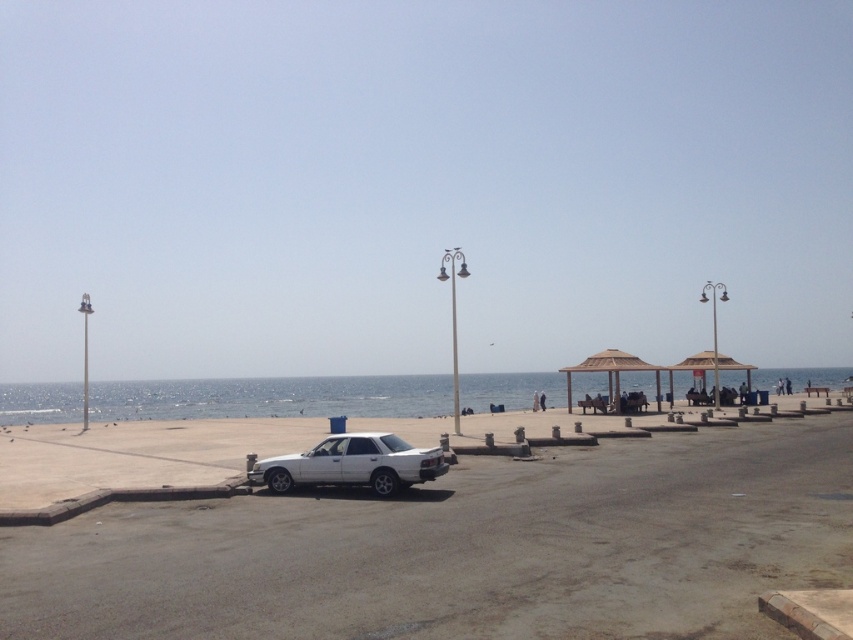
Question: Can you confirm if white matte car at lower left is positioned to the right of blue water at center?

Choices:
 (A) yes
 (B) no

Answer: (A)

Question: Which of the following is the farthest from the observer?

Choices:
 (A) white matte sedan at center
 (B) brown woven umbrella at center
 (C) blue water at center

Answer: (C)

Question: Which object is positioned farthest from the white matte sedan at center?

Choices:
 (A) white matte car at lower left
 (B) brown wooden gazebo at center
 (C) brown woven umbrella at center

Answer: (C)

Question: Which point is farther to the camera?

Choices:
 (A) (577, 516)
 (B) (616, 404)

Answer: (B)

Question: Can you confirm if white matte car at lower left is positioned below blue water at center?

Choices:
 (A) no
 (B) yes

Answer: (A)

Question: Is white matte car at lower left smaller than white matte sedan at center?

Choices:
 (A) no
 (B) yes

Answer: (A)